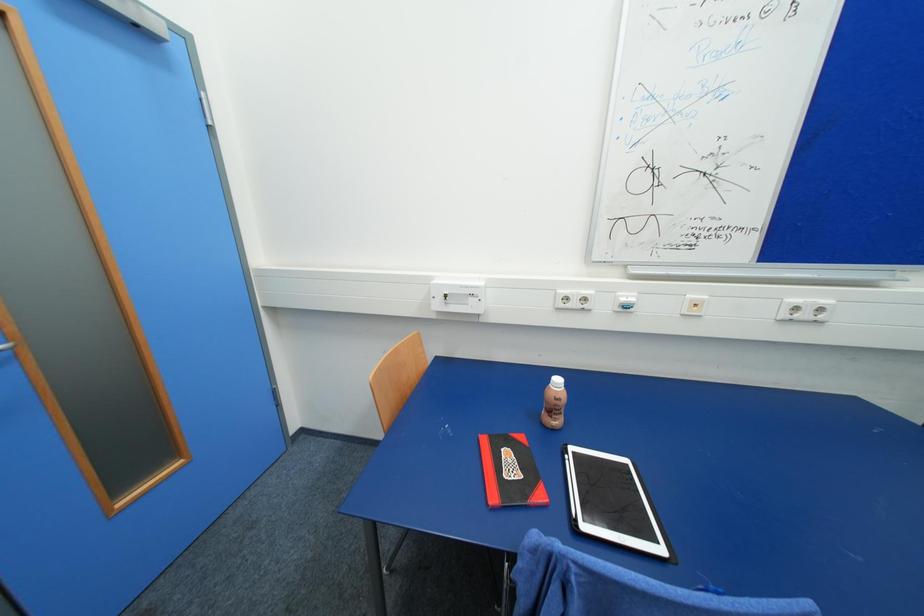
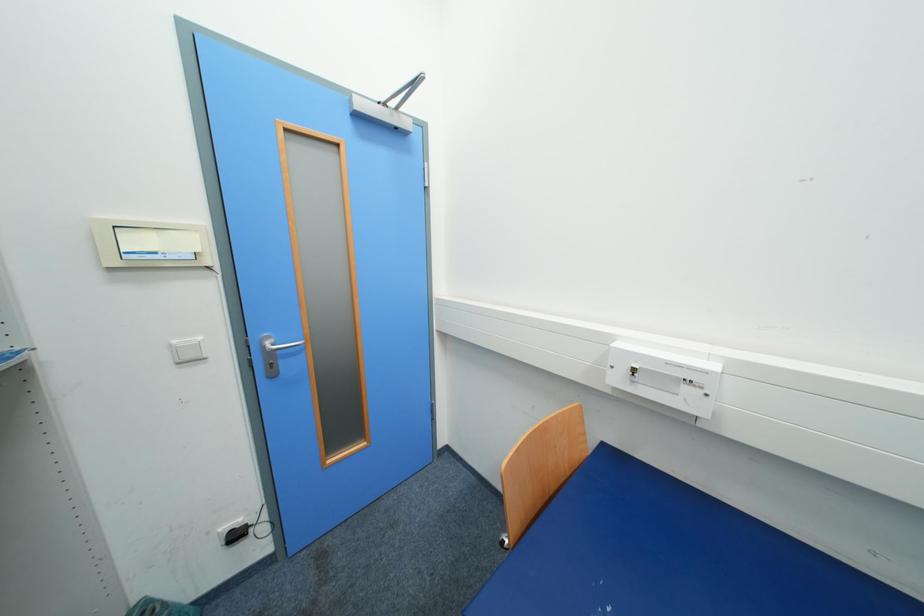
Question: The camera is either moving clockwise (left) or counter-clockwise (right) around the object. The first image is from the beginning of the video and the second image is from the end. Is the camera moving left or right when shooting the video?

Choices:
 (A) Left
 (B) Right

Answer: (B)